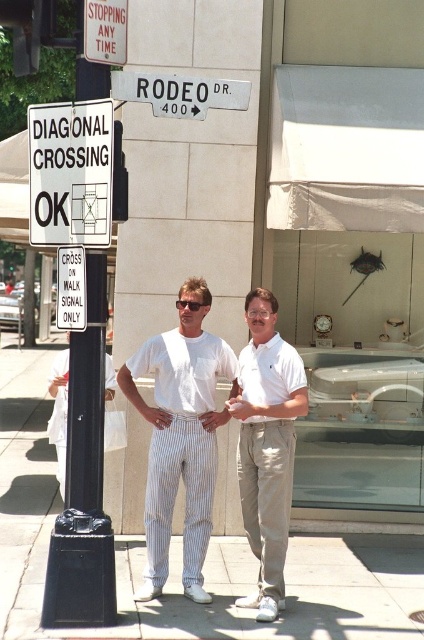
Which is behind, point (180, 396) or point (301, 408)?

The point (180, 396) is more distant.

Is white striped pants at center wider than white cotton shirt at center?

Indeed, white striped pants at center has a greater width compared to white cotton shirt at center.

Image resolution: width=424 pixels, height=640 pixels. In order to click on white striped pants at center in this screenshot , I will do `click(181, 436)`.

Which of these two, black metal pole at left or white plastic street sign at upper center, stands shorter?

Standing shorter between the two is white plastic street sign at upper center.

Who is positioned more to the right, black metal pole at left or white plastic street sign at upper center?

Positioned to the right is white plastic street sign at upper center.

Is point (102, 538) positioned behind point (144, 76)?

That is True.

You are a GUI agent. You are given a task and a screenshot of the screen. Output one action in this format:
    pyautogui.click(x=<x>, y=<y>)
    Task: Click on the black metal pole at left
    Image resolution: width=424 pixels, height=640 pixels.
    Given the screenshot: What is the action you would take?
    click(x=83, y=483)

Is the position of black metal pole at left more distant than that of white plastic sign at upper left?

Yes, it is.

Does black metal pole at left appear over white plastic sign at upper left?

No, black metal pole at left is not above white plastic sign at upper left.

Between point (100, 369) and point (97, 129), which one is positioned in front?

Point (97, 129)

I want to click on black metal pole at left, so click(83, 483).